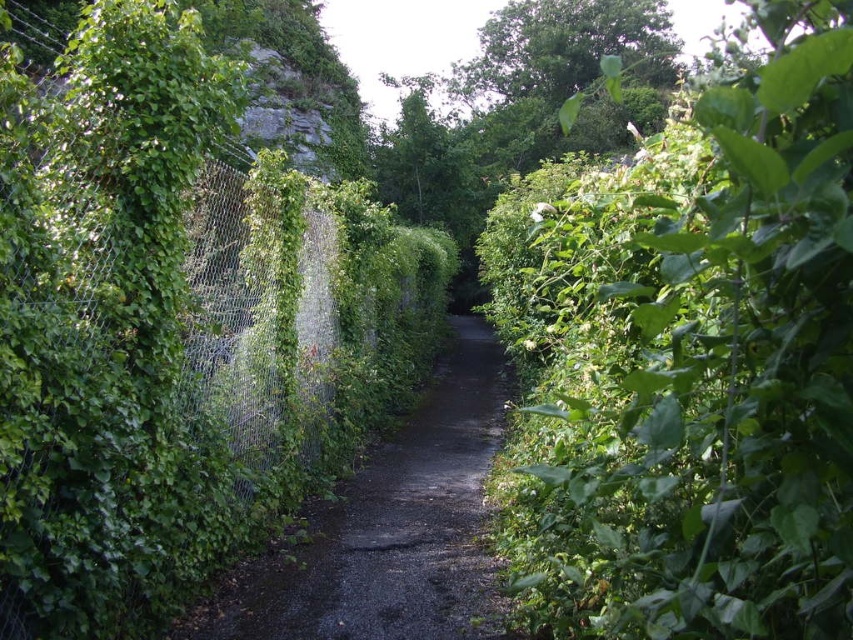
You are a gardener trying to determine which plant to prune first. Based on their widths, which of the two plants, the green leafy bush at right or the green leafy tree at center, should you tackle first if you want to start with the narrower one?

The green leafy bush at right should be pruned first since its width is narrower than the green leafy tree at center.

You are standing on the narrow pathway and want to walk towards the green leafy tree at center. Which direction should you turn to avoid the green leafy bush at right?

You should turn to the right to avoid the green leafy bush at right, as it is located to the left of the green leafy tree at center, meaning the tree is to the right of the bush from your perspective.